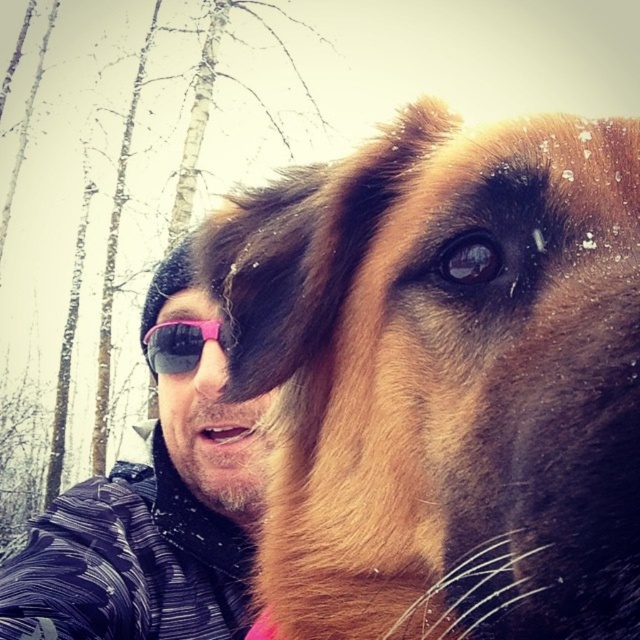
Question: Which object is positioned farthest from the brown furry dog at center?

Choices:
 (A) pink reflective sunglasses at center
 (B) brown fur nose at center

Answer: (B)

Question: Is brown furry dog at center thinner than brown fur nose at center?

Choices:
 (A) no
 (B) yes

Answer: (A)

Question: Which object is farther from the camera taking this photo?

Choices:
 (A) brown furry dog at center
 (B) brown fur nose at center
 (C) pink reflective sunglasses at center
 (D) pink plastic goggles at center

Answer: (D)

Question: Considering the real-world distances, which object is farthest from the brown furry dog at center?

Choices:
 (A) brown fur nose at center
 (B) pink reflective sunglasses at center
 (C) pink plastic goggles at center

Answer: (C)

Question: Where is brown furry dog at center located in relation to pink reflective sunglasses at center in the image?

Choices:
 (A) below
 (B) above

Answer: (B)

Question: Can you confirm if brown furry dog at center is thinner than pink reflective sunglasses at center?

Choices:
 (A) yes
 (B) no

Answer: (A)